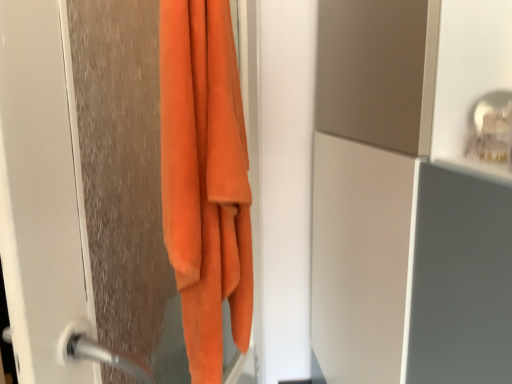
Question: From their relative heights in the image, would you say orange fuzzy towel at left is taller or shorter than orange soft towel at left?

Choices:
 (A) tall
 (B) short

Answer: (A)

Question: In the image, is orange fuzzy towel at left on the left side or the right side of orange soft towel at left?

Choices:
 (A) left
 (B) right

Answer: (A)

Question: Considering their positions, is orange fuzzy towel at left located in front of or behind orange soft towel at left?

Choices:
 (A) behind
 (B) front

Answer: (B)

Question: Considering the positions of point (221, 304) and point (54, 150), is point (221, 304) closer or farther from the camera than point (54, 150)?

Choices:
 (A) farther
 (B) closer

Answer: (A)

Question: In the image, is orange soft towel at left positioned in front of or behind orange fuzzy towel at left?

Choices:
 (A) behind
 (B) front

Answer: (A)

Question: From the image's perspective, is orange soft towel at left above or below orange fuzzy towel at left?

Choices:
 (A) below
 (B) above

Answer: (B)

Question: From a real-world perspective, is orange soft towel at left above or below orange fuzzy towel at left?

Choices:
 (A) above
 (B) below

Answer: (A)